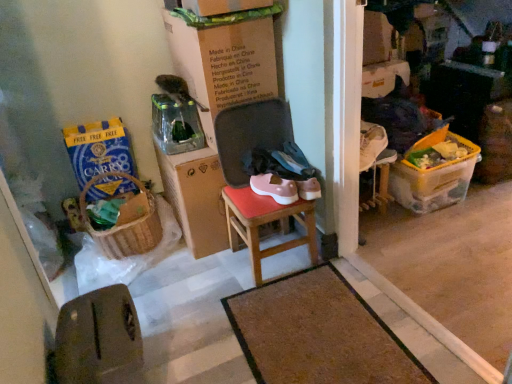
Question: Is blue paper bag at left, arranged as the second box when viewed from the right, closer to the viewer compared to brown textured mat at center?

Choices:
 (A) yes
 (B) no

Answer: (B)

Question: From a real-world perspective, is blue paper bag at left, arranged as the second box when viewed from the right, over brown textured mat at center?

Choices:
 (A) no
 (B) yes

Answer: (B)

Question: Can you confirm if blue paper bag at left, which is the first box in left-to-right order, is smaller than brown textured mat at center?

Choices:
 (A) no
 (B) yes

Answer: (A)

Question: Considering the relative sizes of blue paper bag at left, which is the first box in left-to-right order, and brown textured mat at center in the image provided, is blue paper bag at left, which is the first box in left-to-right order, taller than brown textured mat at center?

Choices:
 (A) no
 (B) yes

Answer: (B)

Question: From the image's perspective, does blue paper bag at left, which is the first box in left-to-right order, appear lower than brown textured mat at center?

Choices:
 (A) no
 (B) yes

Answer: (A)

Question: Does blue paper bag at left, arranged as the second box when viewed from the right, have a greater width compared to brown textured mat at center?

Choices:
 (A) no
 (B) yes

Answer: (A)

Question: Is cardboard box at center in front of wooden stool at center?

Choices:
 (A) no
 (B) yes

Answer: (B)

Question: From the image's perspective, is cardboard box at center under wooden stool at center?

Choices:
 (A) no
 (B) yes

Answer: (A)

Question: Considering the relative sizes of cardboard box at center and wooden stool at center in the image provided, is cardboard box at center bigger than wooden stool at center?

Choices:
 (A) no
 (B) yes

Answer: (B)

Question: Is there a large distance between cardboard box at center and wooden stool at center?

Choices:
 (A) yes
 (B) no

Answer: (B)

Question: Considering the relative sizes of cardboard box at center and wooden stool at center in the image provided, is cardboard box at center thinner than wooden stool at center?

Choices:
 (A) yes
 (B) no

Answer: (B)

Question: From the image's perspective, is cardboard box at center above wooden stool at center?

Choices:
 (A) no
 (B) yes

Answer: (B)

Question: Is blue paper bag at left, which is the first box in left-to-right order, outside cardboard box at center?

Choices:
 (A) no
 (B) yes

Answer: (B)